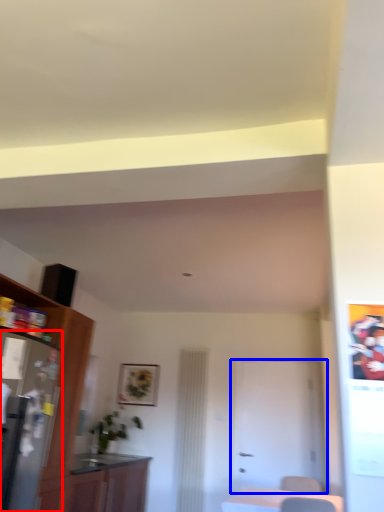
Question: Which of the following is the farthest to the observer, appliance (highlighted by a red box) or door (highlighted by a blue box)?

Choices:
 (A) appliance
 (B) door

Answer: (B)